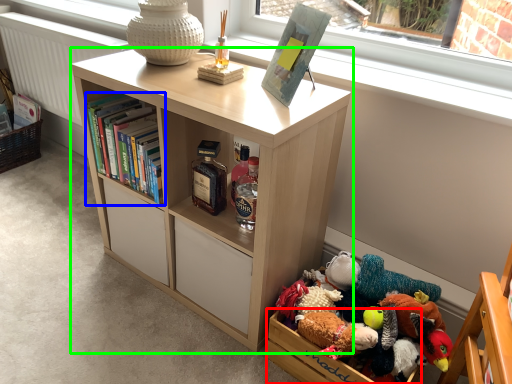
Question: Estimate the real-world distances between objects in this image. Which object is closer to storage box (highlighted by a red box), book (highlighted by a blue box) or bookcase (highlighted by a green box)?

Choices:
 (A) book
 (B) bookcase

Answer: (B)